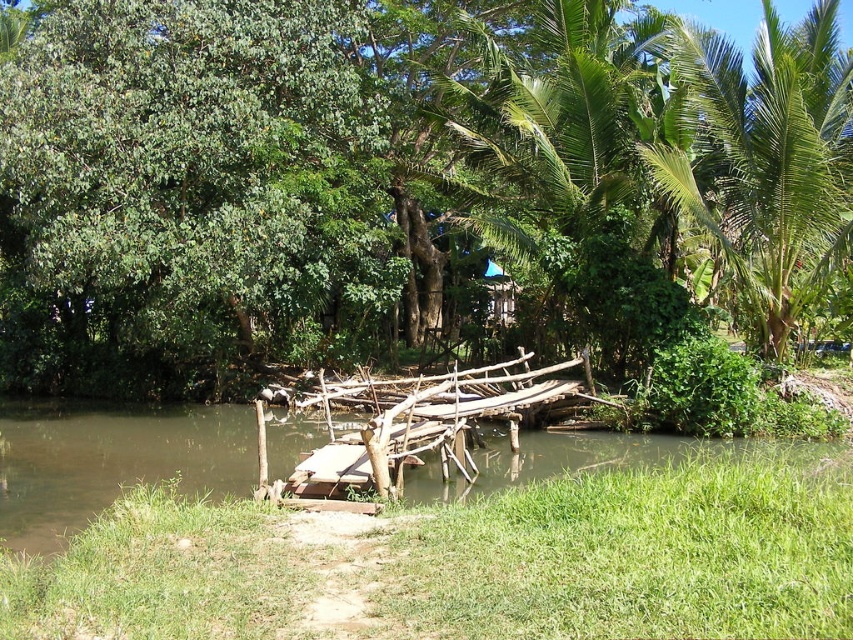
Does green leafy tree at center have a lesser height compared to brown wooden bridge at center?

Incorrect, green leafy tree at center's height does not fall short of brown wooden bridge at center's.

Does green leafy tree at center appear on the right side of brown wooden bridge at center?

Yes, green leafy tree at center is to the right of brown wooden bridge at center.

Does point (13, 333) lie behind point (51, 461)?

Yes, it is behind point (51, 461).

Where is `green leafy tree at center`? This screenshot has width=853, height=640. green leafy tree at center is located at coordinates (392, 177).

Between point (194, 156) and point (352, 349), which one is positioned in front?

Point (194, 156) is more forward.

Is green leafy tree at center closer to camera compared to green leafy tree at upper left?

No.

What do you see at coordinates (392, 177) in the screenshot? I see `green leafy tree at center` at bounding box center [392, 177].

Image resolution: width=853 pixels, height=640 pixels. In order to click on green leafy tree at center in this screenshot , I will do 392,177.

Is green leafy tree at center bigger than green leafy palm tree at upper right?

Correct, green leafy tree at center is larger in size than green leafy palm tree at upper right.

Does point (791, 328) lie behind point (782, 248)?

That is True.

Who is more forward, (379, 17) or (804, 244)?

Point (804, 244) is in front.

The height and width of the screenshot is (640, 853). Find the location of `green leafy tree at center`. green leafy tree at center is located at coordinates (392, 177).